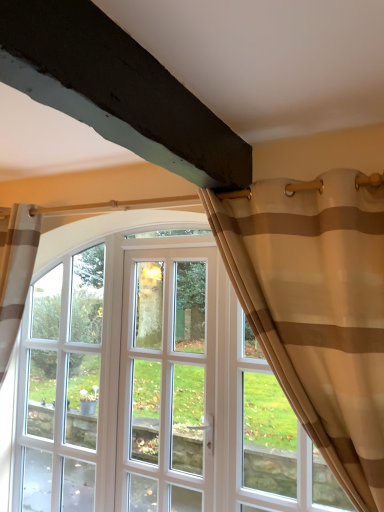
Question: Is beige sheer curtain at upper right further to the viewer compared to clear glass window at center?

Choices:
 (A) no
 (B) yes

Answer: (A)

Question: Is beige sheer curtain at upper right oriented away from clear glass window at center?

Choices:
 (A) no
 (B) yes

Answer: (A)

Question: Could you tell me if beige sheer curtain at upper right is facing clear glass window at center?

Choices:
 (A) no
 (B) yes

Answer: (A)

Question: Can you confirm if beige sheer curtain at upper right is positioned to the right of clear glass window at center?

Choices:
 (A) no
 (B) yes

Answer: (B)

Question: Does beige sheer curtain at upper right have a lesser height compared to clear glass window at center?

Choices:
 (A) no
 (B) yes

Answer: (B)

Question: In terms of size, does white glass door at center appear bigger or smaller than clear glass window at center?

Choices:
 (A) small
 (B) big

Answer: (A)

Question: From the image's perspective, is white glass door at center located above or below clear glass window at center?

Choices:
 (A) below
 (B) above

Answer: (B)

Question: From their relative heights in the image, would you say white glass door at center is taller or shorter than clear glass window at center?

Choices:
 (A) tall
 (B) short

Answer: (B)

Question: Would you say white glass door at center is to the left or to the right of clear glass window at center in the picture?

Choices:
 (A) left
 (B) right

Answer: (B)

Question: In the image, is white glass door at center positioned in front of or behind beige sheer curtain at upper right?

Choices:
 (A) front
 (B) behind

Answer: (B)

Question: From the image's perspective, relative to beige sheer curtain at upper right, is white glass door at center above or below?

Choices:
 (A) above
 (B) below

Answer: (B)

Question: Considering the positions of white glass door at center and beige sheer curtain at upper right in the image, is white glass door at center wider or thinner than beige sheer curtain at upper right?

Choices:
 (A) thin
 (B) wide

Answer: (A)

Question: From a real-world perspective, is white glass door at center physically located above or below beige sheer curtain at upper right?

Choices:
 (A) below
 (B) above

Answer: (A)

Question: Considering the positions of clear glass window at center and white glass door at center in the image, is clear glass window at center taller or shorter than white glass door at center?

Choices:
 (A) tall
 (B) short

Answer: (A)

Question: From a real-world perspective, is clear glass window at center above or below white glass door at center?

Choices:
 (A) above
 (B) below

Answer: (B)